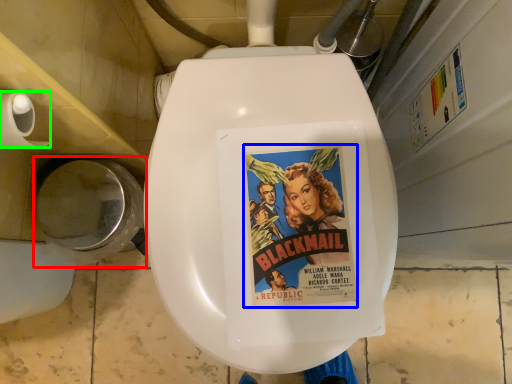
Question: Which object is positioned closest to toilet bowl (highlighted by a red box)? Select from movie poster (highlighted by a blue box) and toilet paper (highlighted by a green box).

Choices:
 (A) movie poster
 (B) toilet paper

Answer: (B)